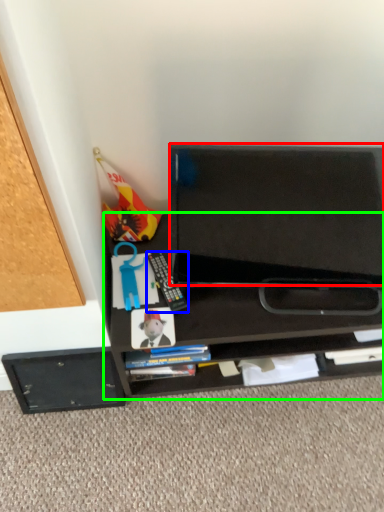
Question: Estimate the real-world distances between objects in this image. Which object is closer to back (highlighted by a red box), equipment (highlighted by a blue box) or desk (highlighted by a green box)?

Choices:
 (A) equipment
 (B) desk

Answer: (B)